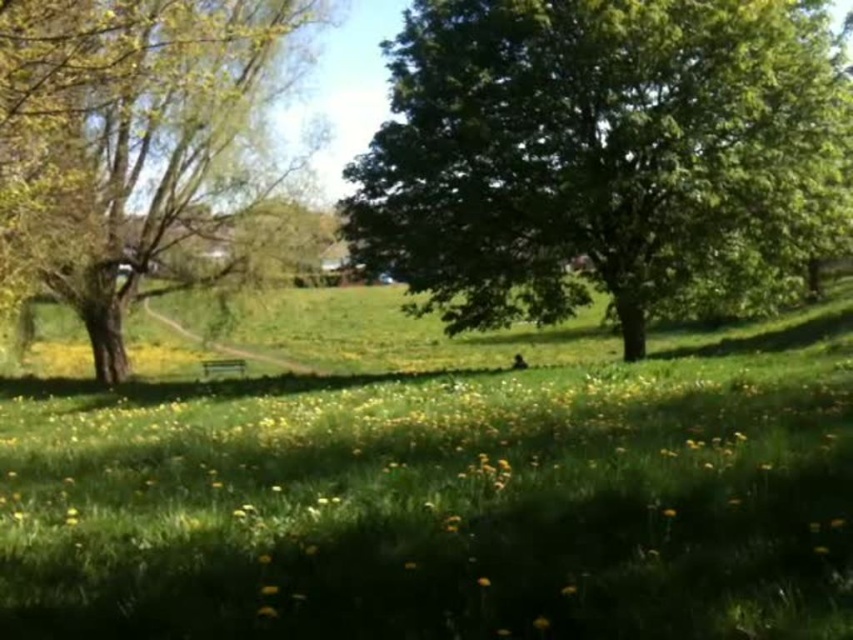
The width and height of the screenshot is (853, 640). I want to click on green grass at center, so click(437, 483).

Is green grass at center shorter than green leafy tree at left?

Yes.

Is point (55, 536) positioned before point (32, 196)?

Yes, it is.

Locate an element on the screen. The width and height of the screenshot is (853, 640). green grass at center is located at coordinates click(437, 483).

Does green leafy tree at center appear over green leafy tree at left?

Yes, green leafy tree at center is above green leafy tree at left.

Is green leafy tree at center positioned at the back of green leafy tree at left?

Yes, green leafy tree at center is behind green leafy tree at left.

The width and height of the screenshot is (853, 640). Describe the element at coordinates (601, 154) in the screenshot. I see `green leafy tree at center` at that location.

Find the location of a particular element. The height and width of the screenshot is (640, 853). green leafy tree at center is located at coordinates (601, 154).

Does green grass at center appear on the right side of green leafy tree at center?

In fact, green grass at center is to the left of green leafy tree at center.

Who is more forward, (93,436) or (729,8)?

Point (93,436) is in front.

At what (x,y) coordinates should I click in order to perform the action: click on green grass at center. Please return your answer as a coordinate pair (x, y). The height and width of the screenshot is (640, 853). Looking at the image, I should click on (437, 483).